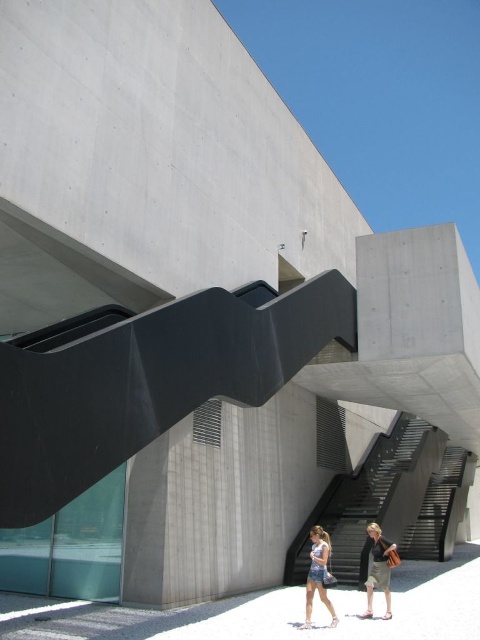
Does point (364, 618) come in front of point (315, 563)?

No, (364, 618) is behind (315, 563).

Which is behind, point (373, 564) or point (325, 532)?

The point (373, 564) is more distant.

The image size is (480, 640). Describe the element at coordinates (319, 576) in the screenshot. I see `denim shorts at center` at that location.

This screenshot has height=640, width=480. Identify the location of denim shorts at center. (319, 576).

Based on the photo, is black textured stairs at center positioned behind denim shorts at center?

Yes, black textured stairs at center is further from the viewer.

Is black textured stairs at center bigger than denim shorts at center?

Indeed, black textured stairs at center has a larger size compared to denim shorts at center.

Locate an element on the screen. black textured stairs at center is located at coordinates (362, 502).

Which is above, black textured stairs at center or denim shorts at lower center?

denim shorts at lower center is higher up.

Does black textured stairs at center have a greater width compared to denim shorts at lower center?

Indeed, black textured stairs at center has a greater width compared to denim shorts at lower center.

Is point (397, 448) closer to camera compared to point (324, 554)?

No, it is behind (324, 554).

You are a GUI agent. You are given a task and a screenshot of the screen. Output one action in this format:
    pyautogui.click(x=<x>, y=<y>)
    Task: Click on the black textured stairs at center
    
    Given the screenshot: What is the action you would take?
    tap(362, 502)